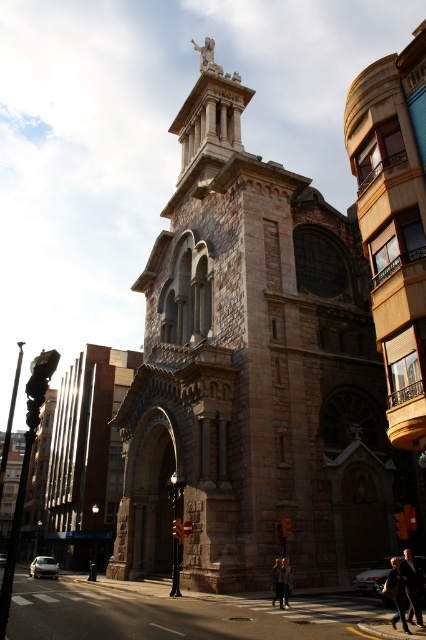
Who is lower down, brown stone tower at center or dark brown leather jacket at center?

dark brown leather jacket at center is lower down.

Between point (362, 266) and point (281, 596), which one is positioned in front?

Point (281, 596) is in front.

Is point (290, 336) farther from camera compared to point (275, 582)?

Yes, it is.

Where is `brown stone tower at center`? The image size is (426, 640). brown stone tower at center is located at coordinates (253, 372).

Does dark brown leather jacket at center have a smaller size compared to blonde hair person at center?

Correct, dark brown leather jacket at center occupies less space than blonde hair person at center.

Which is in front, point (279, 584) or point (285, 568)?

Point (279, 584) is in front.

Identify the location of dark brown leather jacket at center. (278, 580).

Is dark gray suit at center shorter than blonde hair person at center?

No, dark gray suit at center is not shorter than blonde hair person at center.

Can you confirm if dark gray suit at center is positioned below blonde hair person at center?

No, dark gray suit at center is not below blonde hair person at center.

Based on the photo, who is more forward, (406,595) or (287,589)?

Point (406,595) is in front.

You are a GUI agent. You are given a task and a screenshot of the screen. Output one action in this format:
    pyautogui.click(x=<x>, y=<y>)
    Task: Click on the dark gray suit at center
    The image size is (426, 640).
    Given the screenshot: What is the action you would take?
    pyautogui.click(x=411, y=586)